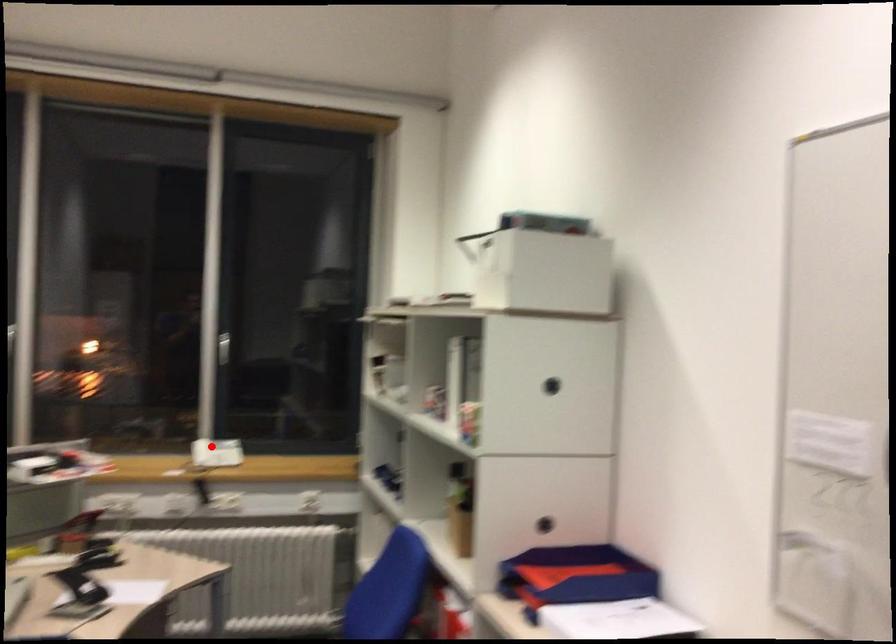
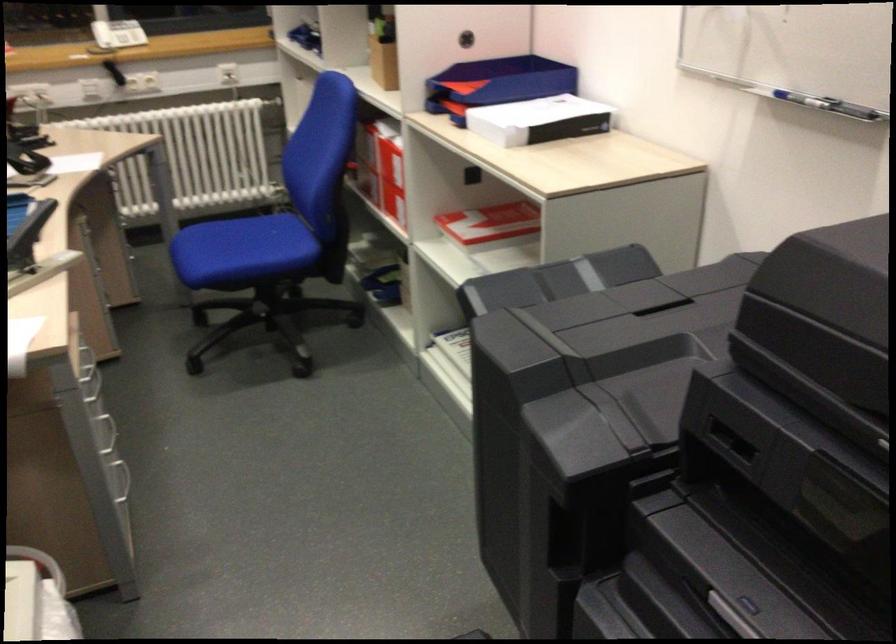
Where in the second image is the point corresponding to the highlighted location from the first image?

(117, 33)